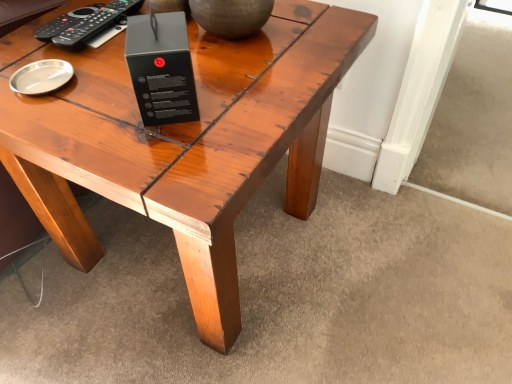
At what (x,y) coordinates should I click in order to perform the action: click on vacant space to the right of shiny wood table at center. Please return your answer as a coordinate pair (x, y). Looking at the image, I should click on (398, 270).